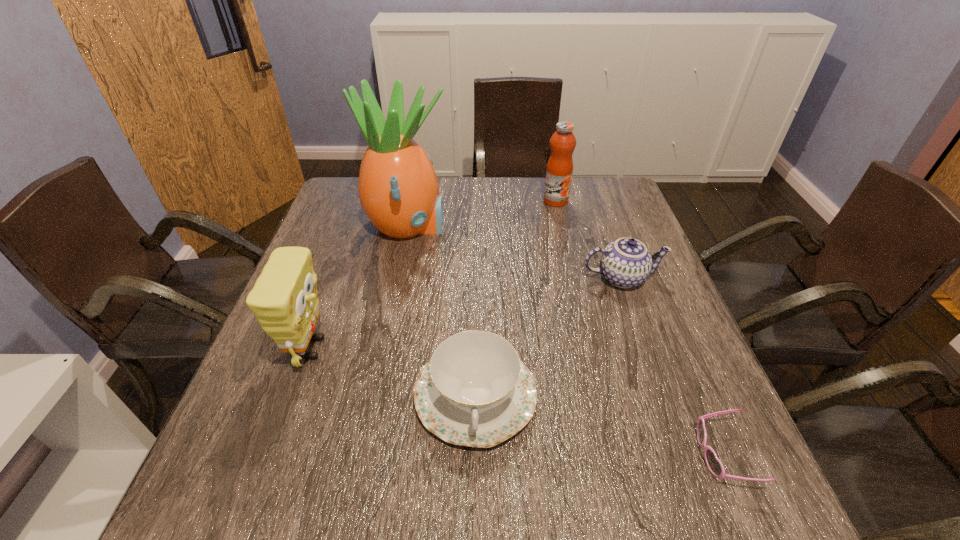
You are a GUI agent. You are given a task and a screenshot of the screen. Output one action in this format:
    pyautogui.click(x=<x>, y=<y>)
    Task: Click on the sponge that is at the left edge
    This screenshot has width=960, height=540.
    Given the screenshot: What is the action you would take?
    pyautogui.click(x=284, y=299)

At what (x,y) coordinates should I click in order to perform the action: click on chinaware located in the right edge section of the desktop. Please return your answer as a coordinate pair (x, y). This screenshot has width=960, height=540. Looking at the image, I should click on (625, 263).

You are a GUI agent. You are given a task and a screenshot of the screen. Output one action in this format:
    pyautogui.click(x=<x>, y=<y>)
    Task: Click on the sunglasses positioned at the right edge
    
    Given the screenshot: What is the action you would take?
    click(714, 465)

At what (x,y) coordinates should I click in order to perform the action: click on object that is at the far left corner. Please return your answer as a coordinate pair (x, y). Image resolution: width=960 pixels, height=540 pixels. Looking at the image, I should click on (398, 189).

At what (x,y) coordinates should I click in order to perform the action: click on object positioned at the near right corner. Please return your answer as a coordinate pair (x, y). Looking at the image, I should click on (714, 465).

What are the coordinates of `free space at the near edge of the desktop` in the screenshot? It's located at (445, 478).

Locate an element on the screen. blank space at the left edge of the desktop is located at coordinates (324, 322).

The height and width of the screenshot is (540, 960). In the image, there is a desktop. Identify the location of vacant space at the right edge. (694, 457).

This screenshot has width=960, height=540. I want to click on vacant area at the near right corner, so click(x=675, y=481).

Identify the location of free area in between the fruit juice and the sponge. (434, 274).